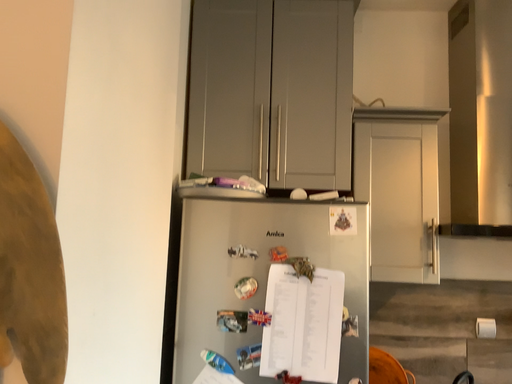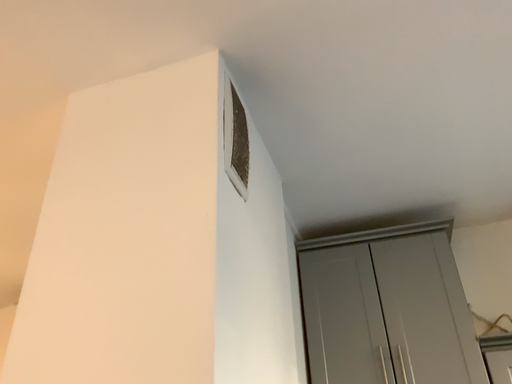
Question: Which way did the camera rotate in the video?

Choices:
 (A) rotated right
 (B) rotated left

Answer: (B)